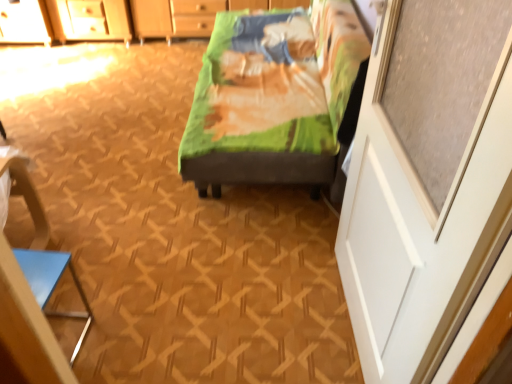
Image resolution: width=512 pixels, height=384 pixels. What do you see at coordinates (42, 250) in the screenshot?
I see `blue glossy triangle at lower left` at bounding box center [42, 250].

What is the approximate height of white matte screen door at right?

4.19 feet.

Where is `green fabric bed at center`? The width and height of the screenshot is (512, 384). green fabric bed at center is located at coordinates (275, 108).

Considering the sizes of objects green fabric bed at center and blue glossy triangle at lower left in the image provided, who is taller, green fabric bed at center or blue glossy triangle at lower left?

green fabric bed at center.

Are green fabric bed at center and blue glossy triangle at lower left located far from each other?

Indeed, green fabric bed at center is not near blue glossy triangle at lower left.

From the image's perspective, is green fabric bed at center above or below blue glossy triangle at lower left?

Clearly, from the image's perspective, green fabric bed at center is above blue glossy triangle at lower left.

Consider the image. Does green fabric bed at center have a smaller size compared to blue glossy triangle at lower left?

No.

Considering the positions of objects white matte screen door at right and green fabric bed at center in the image provided, who is more to the right, white matte screen door at right or green fabric bed at center?

Positioned to the right is white matte screen door at right.

Who is bigger, white matte screen door at right or green fabric bed at center?

With larger size is green fabric bed at center.

Is white matte screen door at right inside the boundaries of green fabric bed at center, or outside?

white matte screen door at right exists outside the volume of green fabric bed at center.

Measure the distance between white matte screen door at right and green fabric bed at center.

white matte screen door at right is 76.96 centimeters away from green fabric bed at center.

Considering the positions of objects blue glossy triangle at lower left and white matte screen door at right in the image provided, who is in front, blue glossy triangle at lower left or white matte screen door at right?

Positioned in front is white matte screen door at right.

Is blue glossy triangle at lower left inside the boundaries of white matte screen door at right, or outside?

blue glossy triangle at lower left lies outside white matte screen door at right.

Does blue glossy triangle at lower left turn towards white matte screen door at right?

No, blue glossy triangle at lower left is not turned towards white matte screen door at right.

Which object is wider, blue glossy triangle at lower left or green fabric bed at center?

With larger width is green fabric bed at center.

From the picture: Is blue glossy triangle at lower left directly adjacent to green fabric bed at center?

They are not placed beside each other.

From a real-world perspective, relative to green fabric bed at center, is blue glossy triangle at lower left vertically above or below?

blue glossy triangle at lower left is below green fabric bed at center.

Would you say green fabric bed at center is part of blue glossy triangle at lower left's contents?

No, green fabric bed at center is not inside blue glossy triangle at lower left.

Is green fabric bed at center not near white matte screen door at right?

No.

Which is more to the left, green fabric bed at center or white matte screen door at right?

green fabric bed at center is more to the left.

Considering the sizes of objects green fabric bed at center and white matte screen door at right in the image provided, who is wider, green fabric bed at center or white matte screen door at right?

Wider between the two is green fabric bed at center.

Is green fabric bed at center bigger than white matte screen door at right?

Correct, green fabric bed at center is larger in size than white matte screen door at right.

From a real-world perspective, which object rests below the other?

In real-world perspective, blue glossy triangle at lower left is lower.

Are white matte screen door at right and blue glossy triangle at lower left far apart?

Yes.

Can we say white matte screen door at right lies outside blue glossy triangle at lower left?

Yes.

Does white matte screen door at right have a greater width compared to blue glossy triangle at lower left?

No, white matte screen door at right is not wider than blue glossy triangle at lower left.

Find the location of a particular element. This screenshot has height=384, width=512. armchair below the green fabric bed at center (from the image's perspective) is located at coordinates (42, 250).

At what (x,y) coordinates should I click in order to perform the action: click on furniture that is behind the white matte screen door at right. Please return your answer as a coordinate pair (x, y). Looking at the image, I should click on (275, 108).

Considering their positions, is green fabric bed at center positioned closer to white matte screen door at right than blue glossy triangle at lower left?

Among the two, green fabric bed at center is located nearer to white matte screen door at right.

From the picture: When comparing their distances from green fabric bed at center, does white matte screen door at right or blue glossy triangle at lower left seem further?

blue glossy triangle at lower left is positioned further to the anchor green fabric bed at center.

Considering their positions, is white matte screen door at right positioned further to blue glossy triangle at lower left than green fabric bed at center?

Among the two, white matte screen door at right is located further to blue glossy triangle at lower left.

When comparing their distances from white matte screen door at right, does blue glossy triangle at lower left or green fabric bed at center seem further?

blue glossy triangle at lower left lies further to white matte screen door at right than the other object.

When comparing their distances from blue glossy triangle at lower left, does green fabric bed at center or white matte screen door at right seem closer?

Based on the image, green fabric bed at center appears to be nearer to blue glossy triangle at lower left.

Looking at the image, which one is located closer to green fabric bed at center, blue glossy triangle at lower left or white matte screen door at right?

white matte screen door at right.

You are a GUI agent. You are given a task and a screenshot of the screen. Output one action in this format:
    pyautogui.click(x=<x>, y=<y>)
    Task: Click on the screen door that lies between green fabric bed at center and blue glossy triangle at lower left from top to bottom
    The height and width of the screenshot is (384, 512).
    Given the screenshot: What is the action you would take?
    pyautogui.click(x=426, y=181)